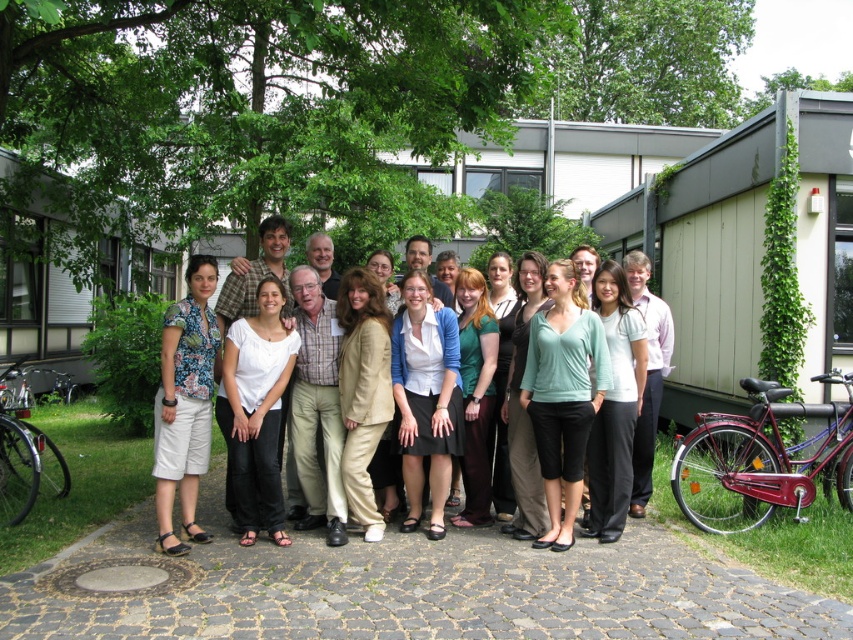
You are standing at the origin point of the image coordinate system. You want to locate the light beige suit at center. In which direction should you move to reach it?

The light beige suit at center is located at point 0.472 in the x direction and 0.279 in the y direction. Since you are at the origin, you should move right along the x axis to 0.472 and up along the y axis to 0.279 to reach it.